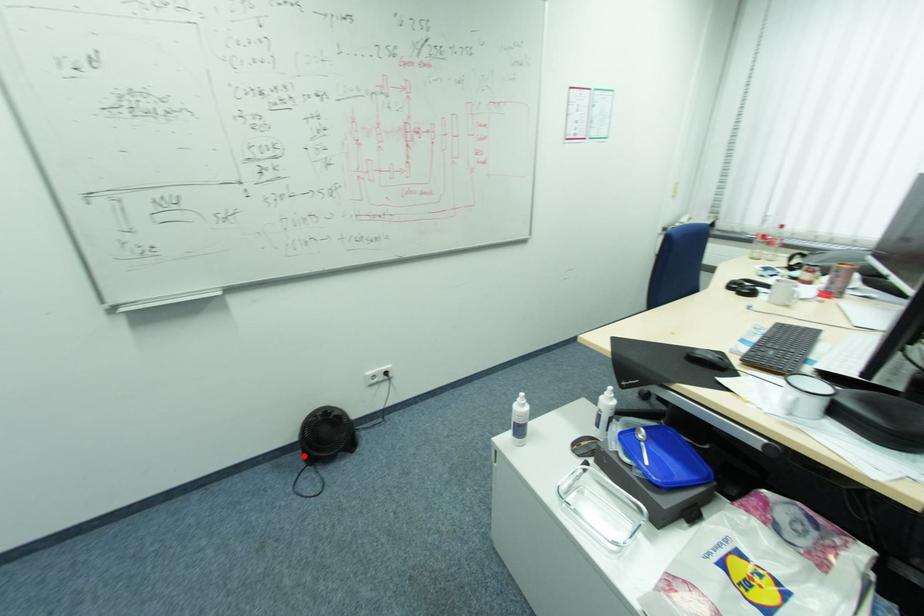
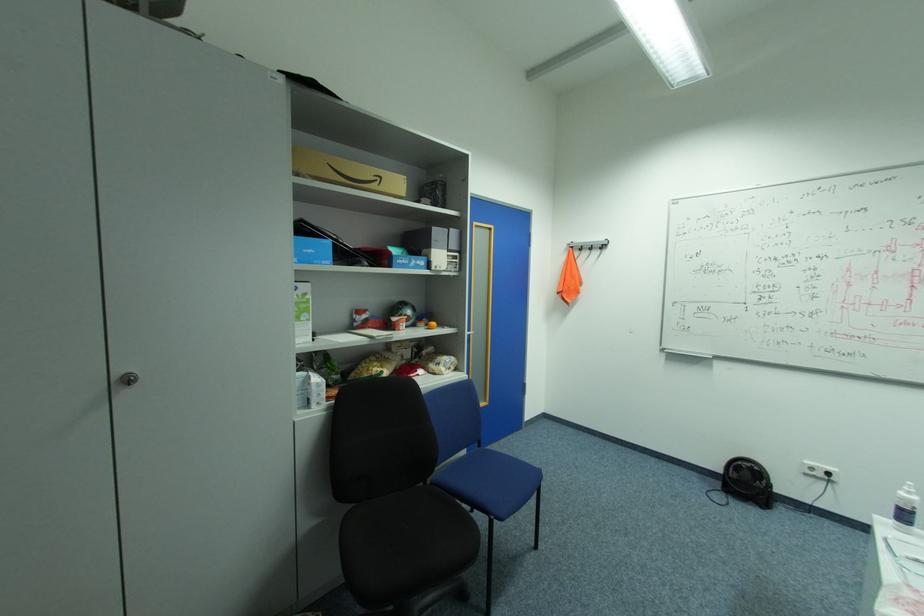
Locate, in the second image, the point that corresponds to the highlighted location in the first image.

(724, 484)